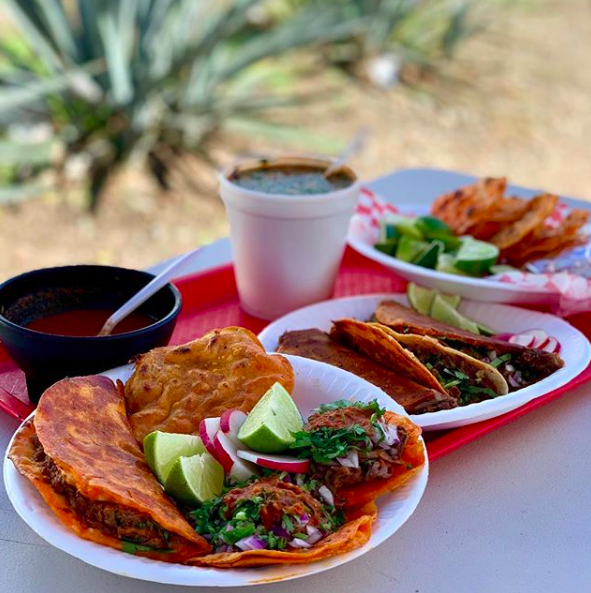
Locate an element on the screen. spoon handle is located at coordinates (168, 267).